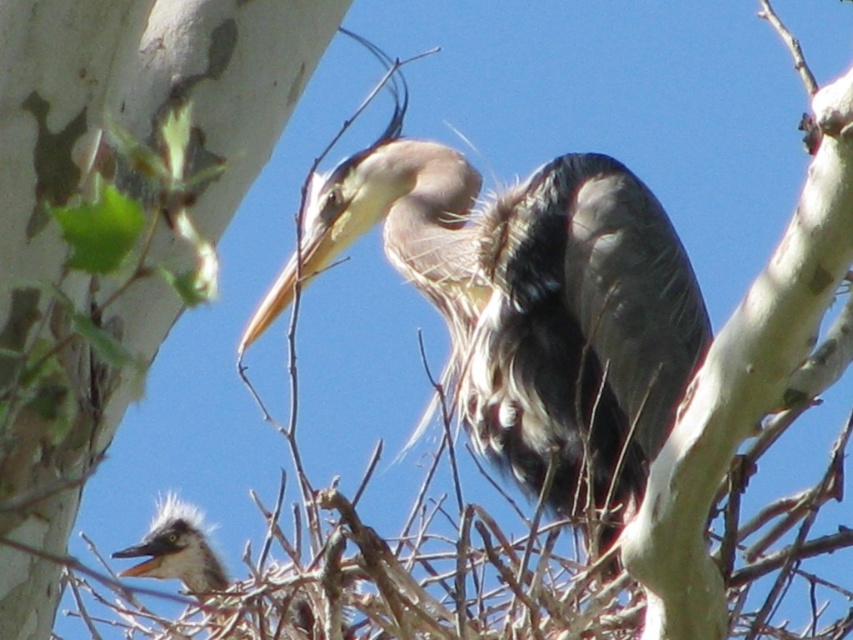
Question: Which object appears farthest from the camera in this image?

Choices:
 (A) gray feathered heron at center
 (B) speckled gray bird at center

Answer: (A)

Question: Which of the following is the farthest from the observer?

Choices:
 (A) (502, 323)
 (B) (194, 541)

Answer: (A)

Question: Can you confirm if gray feathered heron at center is positioned above speckled gray bird at center?

Choices:
 (A) yes
 (B) no

Answer: (A)

Question: Is gray feathered heron at center thinner than speckled gray bird at center?

Choices:
 (A) yes
 (B) no

Answer: (B)

Question: Is gray feathered heron at center positioned before speckled gray bird at center?

Choices:
 (A) yes
 (B) no

Answer: (B)